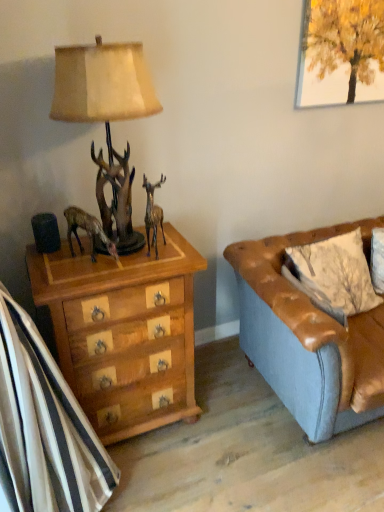
Identify the location of free point to the left of antique brown statue at left. (55, 260).